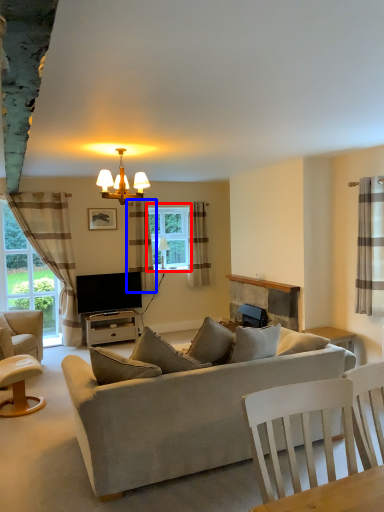
Question: Among these objects, which one is nearest to the camera, window (highlighted by a red box) or curtain (highlighted by a blue box)?

Choices:
 (A) window
 (B) curtain

Answer: (B)